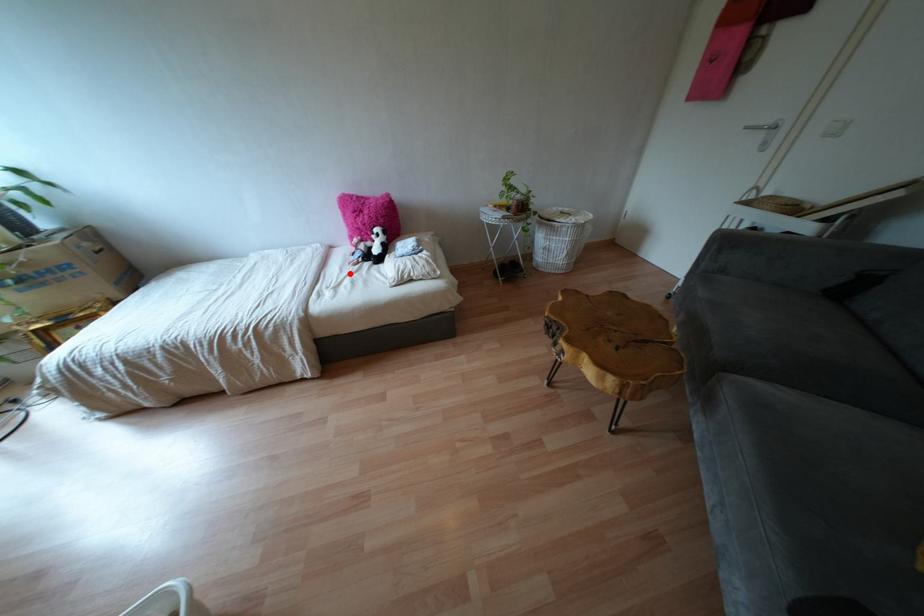
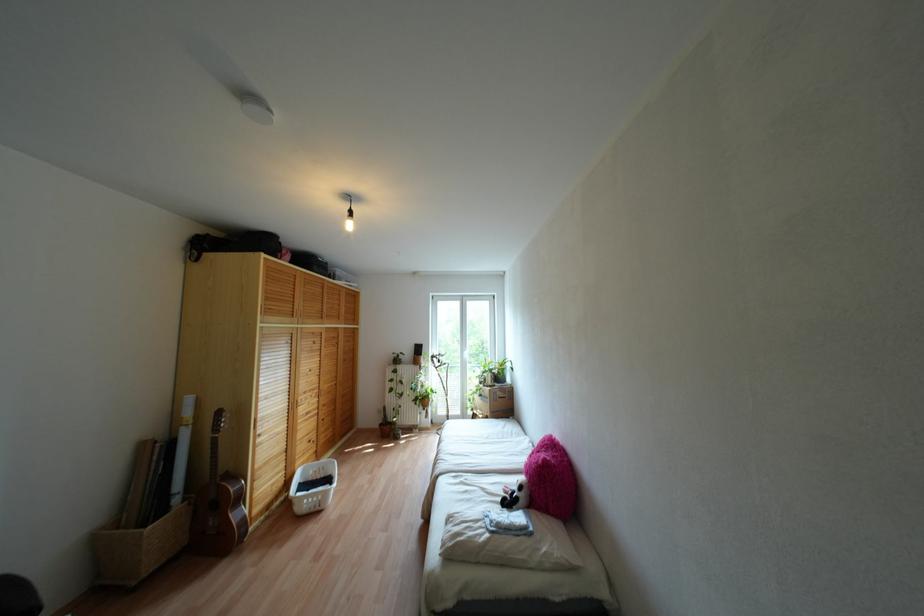
The point at the highlighted location is marked in the first image. Where is the corresponding point in the second image?

(482, 488)